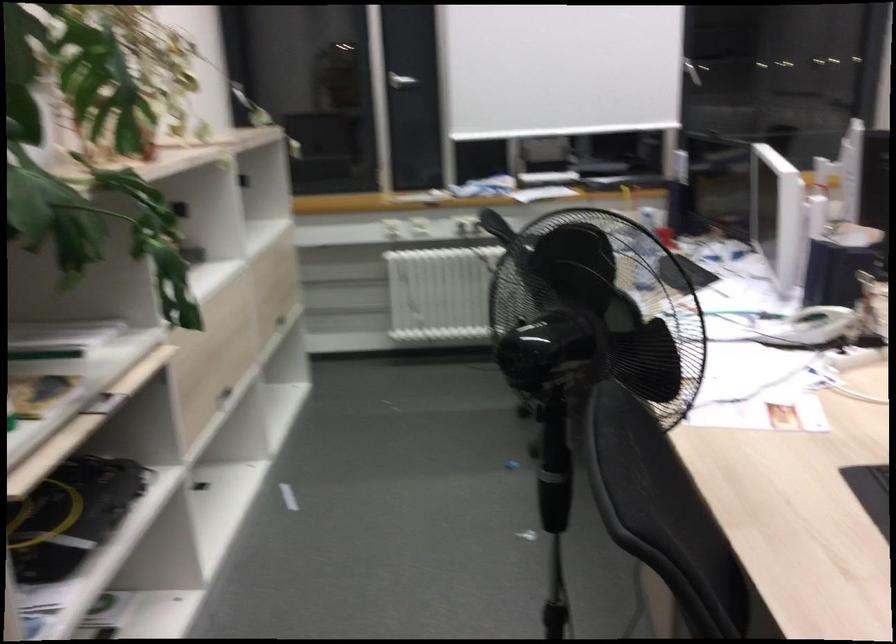
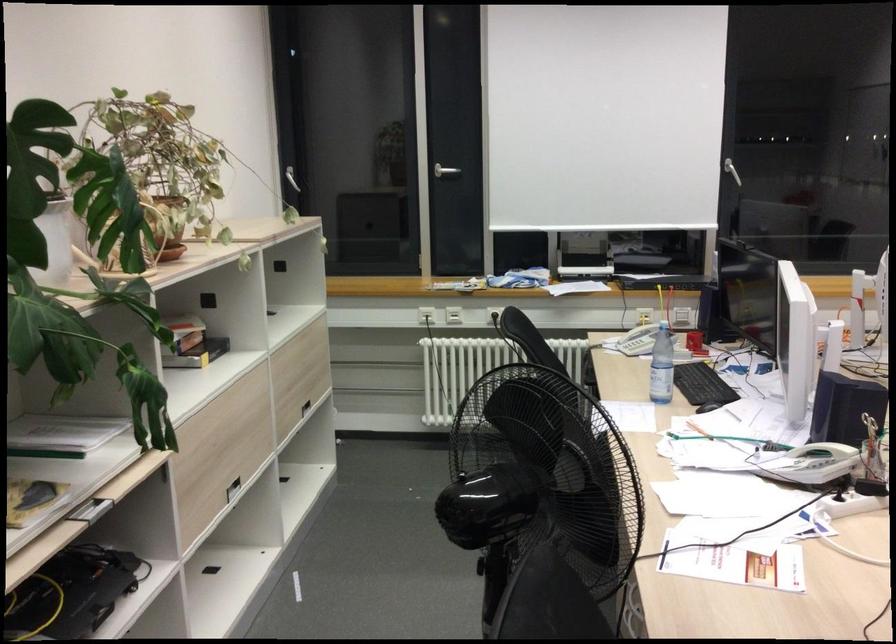
Locate, in the second image, the point that corresponds to (806,323) in the first image.

(814, 464)